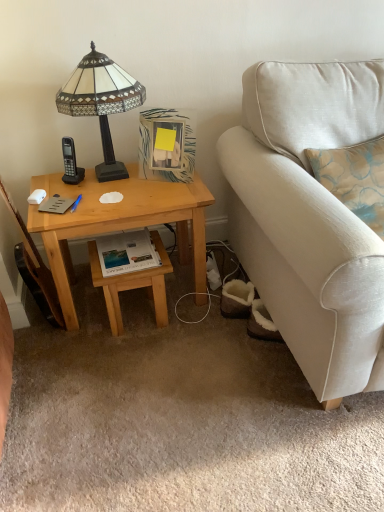
This screenshot has height=512, width=384. What are the coordinates of `blank space situated above light wood stool at lower center (from a real-world perspective)` in the screenshot? It's located at (143, 255).